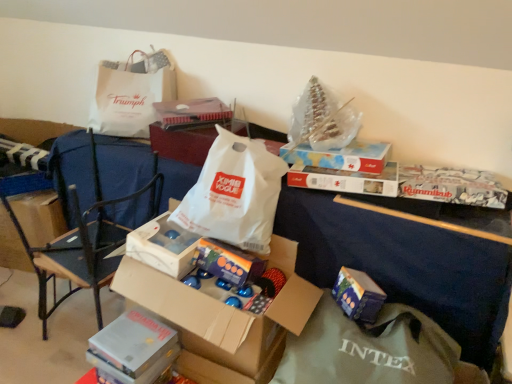
Image resolution: width=512 pixels, height=384 pixels. Describe the element at coordinates (228, 262) in the screenshot. I see `shiny metallic box at center, which is counted as the second gift, starting from the right` at that location.

Find the location of a particular element. This screenshot has height=384, width=512. shiny metallic box at center, the first gift when ordered from left to right is located at coordinates (228, 262).

The image size is (512, 384). What do you see at coordinates (78, 241) in the screenshot?
I see `black metal chair at left` at bounding box center [78, 241].

Describe the element at coordinates (183, 143) in the screenshot. I see `white paper bag at center, placed as the 1th storage box when sorted from top to bottom` at that location.

From the picture: How much space does matte cardboard box at upper center, positioned as the fourth storage box in bottom-to-top order, occupy vertically?

The height of matte cardboard box at upper center, positioned as the fourth storage box in bottom-to-top order, is 3.13 inches.

Find the location of a particular element. The height and width of the screenshot is (384, 512). shiny metallic box at center, which is counted as the second gift, starting from the right is located at coordinates (228, 262).

From the picture: Are white cardboard box at upper center, the 3th storage box positioned from the top, and cardboard box at center far apart?

That's right, there is a large distance between white cardboard box at upper center, the 3th storage box positioned from the top, and cardboard box at center.

How different are the orientations of white cardboard box at upper center, the 3th storage box positioned from the top, and cardboard box at center in degrees?

They differ by 7.23 degrees in their facing directions.

Looking at this image, considering the positions of objects white cardboard box at upper center, the third storage box when ordered from bottom to top, and cardboard box at center in the image provided, who is in front, white cardboard box at upper center, the third storage box when ordered from bottom to top, or cardboard box at center?

cardboard box at center is closer to the camera.

From the image's perspective, is white cardboard box at upper center, the 3th storage box positioned from the top, positioned above or below cardboard box at center?

white cardboard box at upper center, the 3th storage box positioned from the top, is situated higher than cardboard box at center in the image.

Does white paper bag at center, which ranks as the 5th storage box in bottom-to-top order, contain white paper bag at center, which appears as the second storage box when ordered from the bottom?

That's incorrect, white paper bag at center, which appears as the second storage box when ordered from the bottom, is not inside white paper bag at center, which ranks as the 5th storage box in bottom-to-top order.

Would you consider white paper bag at center, placed as the 1th storage box when sorted from top to bottom, to be distant from white paper bag at center, which appears as the second storage box when ordered from the bottom?

No.

From the image's perspective, is white paper bag at center, which ranks as the 5th storage box in bottom-to-top order, positioned above or below white paper bag at center, which appears as the second storage box when ordered from the bottom?

Based on their image positions, white paper bag at center, which ranks as the 5th storage box in bottom-to-top order, is located above white paper bag at center, which appears as the second storage box when ordered from the bottom.

Does white paper bag at center, which ranks as the 5th storage box in bottom-to-top order, come behind white paper bag at center, the fourth storage box positioned from the top?

Yes, it is behind white paper bag at center, the fourth storage box positioned from the top.

Between white paper bag at center, which appears as the second storage box when ordered from the bottom, and white paper bag at center, which one has smaller size?

white paper bag at center, which appears as the second storage box when ordered from the bottom, is smaller.

From the image's perspective, between white paper bag at center, the fourth storage box positioned from the top, and white paper bag at center, which one is located above?

white paper bag at center, the fourth storage box positioned from the top, appears higher in the image.

Is white paper bag at center, the fourth storage box positioned from the top, inside or outside of white paper bag at center?

white paper bag at center, the fourth storage box positioned from the top, is inside white paper bag at center.

From the image's perspective, who appears lower, cardboard box at center or white paper bag at center?

white paper bag at center appears lower in the image.

Does cardboard box at center come behind white paper bag at center?

Yes, it is behind white paper bag at center.

Measure the distance from cardboard box at center to white paper bag at center.

cardboard box at center and white paper bag at center are 1.24 meters apart.

From a real-world perspective, is cardboard box at center physically located above or below white paper bag at center?

cardboard box at center is below white paper bag at center.

Do you think metallic silver storage box at lower center, which is the first storage box in bottom-to-top order, is within white paper bag at center, which appears as the second storage box when ordered from the bottom, or outside of it?

metallic silver storage box at lower center, which is the first storage box in bottom-to-top order, is located beyond the bounds of white paper bag at center, which appears as the second storage box when ordered from the bottom.

Between metallic silver storage box at lower center, which is the fifth storage box from top to bottom, and white paper bag at center, which appears as the second storage box when ordered from the bottom, which one has smaller size?

metallic silver storage box at lower center, which is the fifth storage box from top to bottom.

Is metallic silver storage box at lower center, which is the first storage box in bottom-to-top order, facing towards white paper bag at center, the fourth storage box positioned from the top?

No.

Based on their positions, is blue glossy box at lower right, the first gift when ordered from right to left, located to the left or right of white paper bag at center, positioned as the second grocery bag in top-to-bottom order?

Clearly, blue glossy box at lower right, the first gift when ordered from right to left, is on the right of white paper bag at center, positioned as the second grocery bag in top-to-bottom order, in the image.

Are blue glossy box at lower right, the first gift when ordered from right to left, and white paper bag at center, which is the 1th grocery bag from right to left, beside each other?

blue glossy box at lower right, the first gift when ordered from right to left, and white paper bag at center, which is the 1th grocery bag from right to left, are not in contact.

Is point (362, 286) closer or farther from the camera than point (249, 197)?

Point (362, 286) is closer to the camera than point (249, 197).

From a real-world perspective, which is physically below, white cardboard box at upper center, the third storage box when ordered from bottom to top, or metallic silver storage box at lower center, which is the fifth storage box from top to bottom?

metallic silver storage box at lower center, which is the fifth storage box from top to bottom, from a real-world perspective.

In the scene shown: Is white cardboard box at upper center, the 3th storage box positioned from the top, oriented away from metallic silver storage box at lower center, which is the fifth storage box from top to bottom?

No, white cardboard box at upper center, the 3th storage box positioned from the top, is not facing away from metallic silver storage box at lower center, which is the fifth storage box from top to bottom.

Who is bigger, white cardboard box at upper center, the third storage box when ordered from bottom to top, or metallic silver storage box at lower center, which is the fifth storage box from top to bottom?

Bigger between the two is white cardboard box at upper center, the third storage box when ordered from bottom to top.

Locate an element on the screen. furniture beneath the white cardboard box at upper center, the 3th storage box positioned from the top (from a real-world perspective) is located at coordinates (33, 129).

I want to click on the 3rd storage box above the white paper bag at center, which appears as the second storage box when ordered from the bottom (from the image's perspective), so click(183, 143).

Looking at the image, which one is located further to cardboard box at center, matte cardboard box at upper center, positioned as the fourth storage box in bottom-to-top order, or black metal chair at left?

matte cardboard box at upper center, positioned as the fourth storage box in bottom-to-top order, is further to cardboard box at center.

From the image, which object appears to be nearer to white paper bag at center, matte cardboard box at upper center, the 2th storage box in the top-to-bottom sequence, or white paper bag at center, which ranks as the 5th storage box in bottom-to-top order?

Among the two, matte cardboard box at upper center, the 2th storage box in the top-to-bottom sequence, is located nearer to white paper bag at center.

Based on their spatial positions, is white paper bag at upper left, placed as the first grocery bag when sorted from left to right, or blue glossy box at lower right, the first gift when ordered from right to left, further from white paper bag at center, placed as the 1th storage box when sorted from top to bottom?

Among the two, blue glossy box at lower right, the first gift when ordered from right to left, is located further to white paper bag at center, placed as the 1th storage box when sorted from top to bottom.

When comparing their distances from white paper bag at center, the 2th grocery bag in the left-to-right sequence, does black metal chair at left or white paper bag at upper left, which appears as the 2th grocery bag when viewed from the right, seem further?

white paper bag at upper left, which appears as the 2th grocery bag when viewed from the right, is positioned further to the anchor white paper bag at center, the 2th grocery bag in the left-to-right sequence.

From the image, which object appears to be nearer to white cardboard box at upper center, the 3th storage box positioned from the top, white paper bag at upper left, placed as the first grocery bag when sorted from left to right, or white paper bag at center?

white paper bag at center.

Considering their positions, is metallic silver storage box at lower center, which is the first storage box in bottom-to-top order, positioned further to white cardboard box at upper center, the third storage box when ordered from bottom to top, than black metal chair at left?

black metal chair at left is positioned further to the anchor white cardboard box at upper center, the third storage box when ordered from bottom to top.

Considering their positions, is matte cardboard box at upper center, positioned as the fourth storage box in bottom-to-top order, positioned further to blue glossy box at lower right, the second gift in the left-to-right sequence, than white paper bag at upper left, which ranks as the first grocery bag in back-to-front order?

white paper bag at upper left, which ranks as the first grocery bag in back-to-front order, is further to blue glossy box at lower right, the second gift in the left-to-right sequence.

When comparing their distances from shiny metallic box at center, which is counted as the second gift, starting from the right, does white cardboard box at upper center, the third storage box when ordered from bottom to top, or black metal chair at left seem closer?

white cardboard box at upper center, the third storage box when ordered from bottom to top, is positioned closer to the anchor shiny metallic box at center, which is counted as the second gift, starting from the right.

This screenshot has height=384, width=512. I want to click on grocery bag between white paper bag at center, which ranks as the 5th storage box in bottom-to-top order, and shiny metallic box at center, the first gift when ordered from left to right, in the up-down direction, so click(x=234, y=193).

Where is `gift between black metal chair at left and matte cardboard box at upper center, the 2th storage box in the top-to-bottom sequence`? This screenshot has width=512, height=384. gift between black metal chair at left and matte cardboard box at upper center, the 2th storage box in the top-to-bottom sequence is located at coordinates (228, 262).

Where is `storage box between white paper bag at center, which ranks as the 5th storage box in bottom-to-top order, and blue glossy box at lower right, the first gift when ordered from right to left, in the horizontal direction`? The image size is (512, 384). storage box between white paper bag at center, which ranks as the 5th storage box in bottom-to-top order, and blue glossy box at lower right, the first gift when ordered from right to left, in the horizontal direction is located at coordinates (341, 156).

Where is `gift situated between white paper bag at center, placed as the 1th storage box when sorted from top to bottom, and matte cardboard box at upper center, positioned as the fourth storage box in bottom-to-top order, from left to right`? This screenshot has height=384, width=512. gift situated between white paper bag at center, placed as the 1th storage box when sorted from top to bottom, and matte cardboard box at upper center, positioned as the fourth storage box in bottom-to-top order, from left to right is located at coordinates (228, 262).